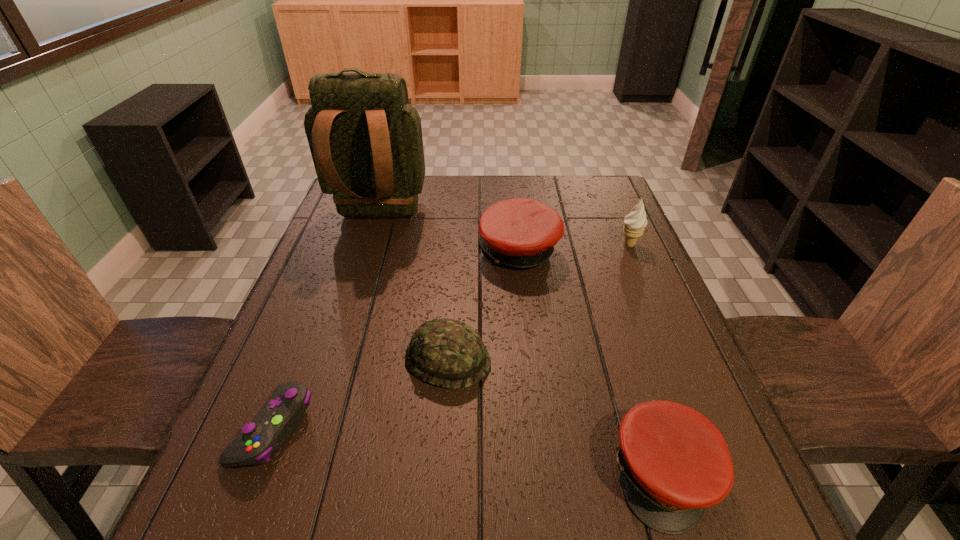
The image size is (960, 540). Identify the location of vacant space located 0.250m on the front-facing side of the farthest cap. (385, 252).

Locate an element on the screen. free space located 0.080m on the front-facing side of the farthest cap is located at coordinates [x=448, y=252].

Where is `vacant space located 0.260m on the front-facing side of the farthest cap`? The image size is (960, 540). vacant space located 0.260m on the front-facing side of the farthest cap is located at coordinates (382, 252).

The height and width of the screenshot is (540, 960). I want to click on vacant space located on the left of the second farthest cap, so click(x=357, y=359).

You are a GUI agent. You are given a task and a screenshot of the screen. Output one action in this format:
    pyautogui.click(x=<x>, y=<y>)
    Task: Click on the free space located on the right of the shortest object
    This screenshot has width=960, height=540.
    Given the screenshot: What is the action you would take?
    pyautogui.click(x=532, y=427)

You are a GUI agent. You are given a task and a screenshot of the screen. Output one action in this format:
    pyautogui.click(x=<x>, y=<y>)
    Task: Click on the object that is at the far edge
    This screenshot has width=960, height=540.
    Given the screenshot: What is the action you would take?
    pyautogui.click(x=365, y=139)

Image resolution: width=960 pixels, height=540 pixels. Find the location of `object located at the near edge`. object located at the near edge is located at coordinates (674, 462).

Identify the location of backpack located in the left edge section of the desktop. The width and height of the screenshot is (960, 540). (365, 139).

In order to click on control that is positioned at the left edge in this screenshot , I will do `click(271, 429)`.

Image resolution: width=960 pixels, height=540 pixels. In order to click on icecream that is at the right edge in this screenshot , I will do `click(634, 224)`.